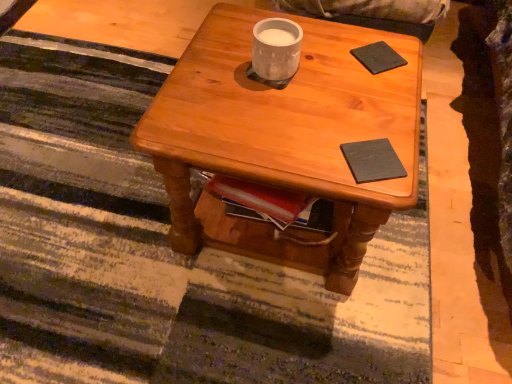
In order to click on free spot to the left of black matte pad at upper right, the second pad in the front-to-back sequence in this screenshot , I will do `click(325, 58)`.